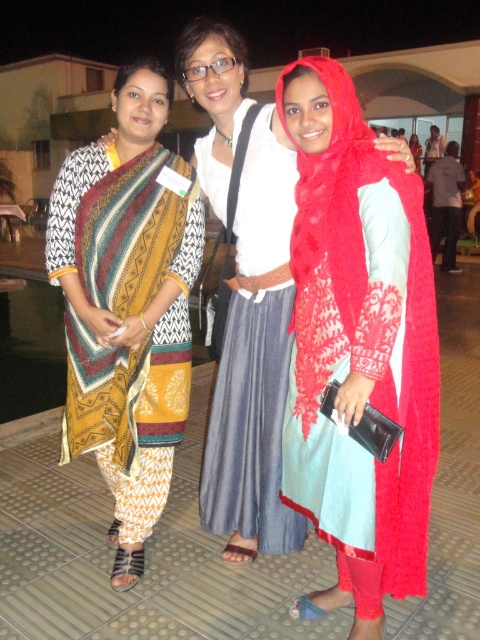
Question: Does red lace scarf at center lie in front of printed cotton dress at left?

Choices:
 (A) yes
 (B) no

Answer: (A)

Question: Which point is closer to the camera?

Choices:
 (A) red lace scarf at center
 (B) printed cotton dress at left

Answer: (A)

Question: Can you confirm if red lace scarf at center is wider than printed cotton dress at left?

Choices:
 (A) no
 (B) yes

Answer: (A)

Question: Which object is closer to the camera taking this photo?

Choices:
 (A) red lace scarf at center
 (B) printed cotton dress at left

Answer: (A)

Question: Does red lace scarf at center appear on the right side of printed cotton dress at left?

Choices:
 (A) yes
 (B) no

Answer: (A)